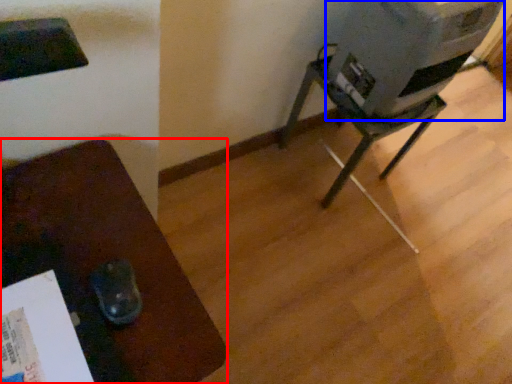
Question: Among these objects, which one is nearest to the camera, furniture (highlighted by a red box) or water cooler (highlighted by a blue box)?

Choices:
 (A) furniture
 (B) water cooler

Answer: (A)